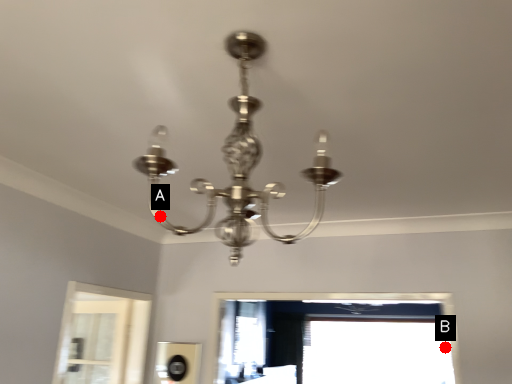
Question: Two points are circled on the image, labeled by A and B beside each circle. Among these points, which one is farthest from the camera?

Choices:
 (A) A is further
 (B) B is further

Answer: (B)